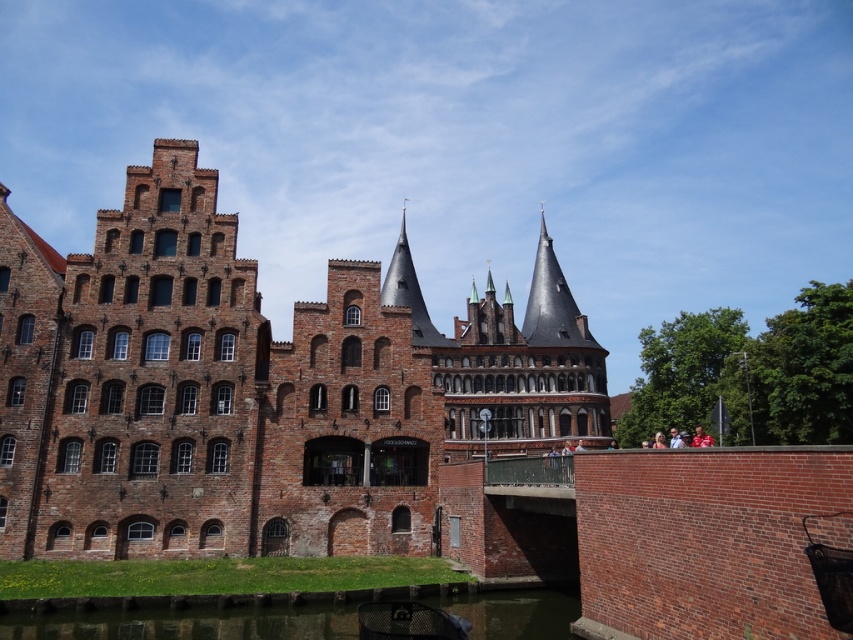
Question: Where is brown brick castle at center located in relation to green grassy bank at lower left in the image?

Choices:
 (A) left
 (B) right

Answer: (B)

Question: Which point is closer to the camera?

Choices:
 (A) green grassy bank at lower left
 (B) brown brick castle at center

Answer: (A)

Question: Can you confirm if brown brick castle at center is thinner than green grassy bank at lower left?

Choices:
 (A) yes
 (B) no

Answer: (B)

Question: Is brown brick castle at center further to the viewer compared to green grassy bank at lower left?

Choices:
 (A) no
 (B) yes

Answer: (B)